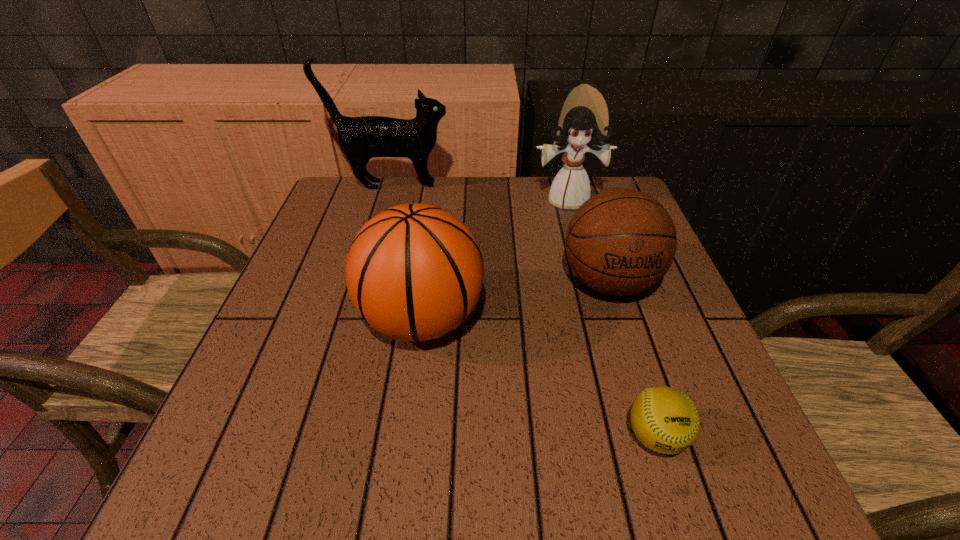
The height and width of the screenshot is (540, 960). What are the coordinates of `cat` in the screenshot? It's located at (361, 138).

At what (x,y) coordinates should I click in order to perform the action: click on doll. Please return your answer as a coordinate pair (x, y). Looking at the image, I should click on (584, 119).

The width and height of the screenshot is (960, 540). Find the location of `the left basketball`. the left basketball is located at coordinates (414, 272).

At what (x,y) coordinates should I click in order to perform the action: click on the fourth tallest object. Please return your answer as a coordinate pair (x, y). Looking at the image, I should click on (619, 242).

The height and width of the screenshot is (540, 960). Identify the location of the right basketball. (619, 242).

The width and height of the screenshot is (960, 540). In order to click on the nearest object in this screenshot , I will do `click(665, 420)`.

Where is `the shortest object`? the shortest object is located at coordinates (665, 420).

Where is `free location located on the face of the cat`? The height and width of the screenshot is (540, 960). free location located on the face of the cat is located at coordinates click(x=504, y=185).

This screenshot has width=960, height=540. Find the location of `vacant space located 0.360m at the front face of the doll`. vacant space located 0.360m at the front face of the doll is located at coordinates (600, 318).

You are a GUI agent. You are given a task and a screenshot of the screen. Output one action in this format:
    pyautogui.click(x=<x>, y=<y>)
    Task: Click on the vacant space situated on the back of the left basketball
    
    Given the screenshot: What is the action you would take?
    pyautogui.click(x=434, y=231)